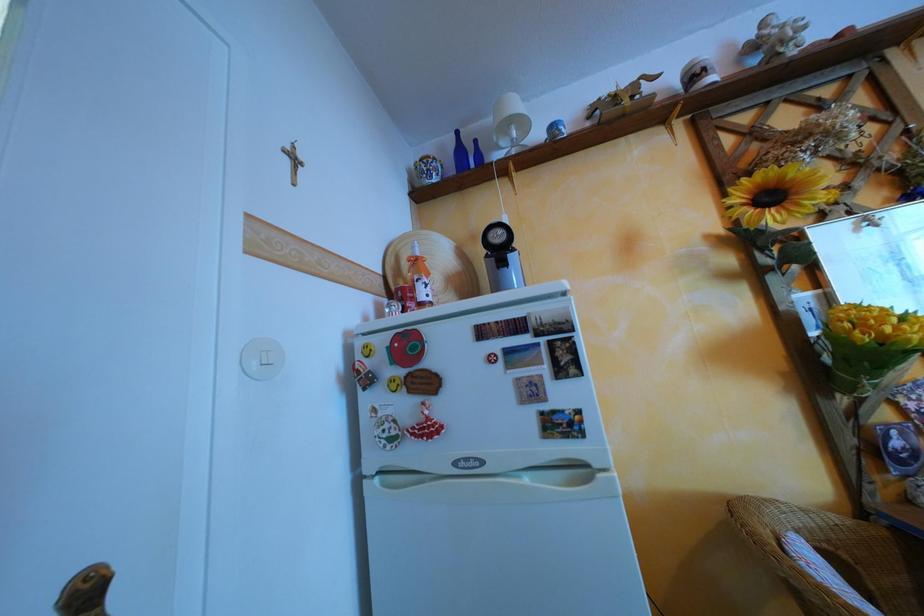
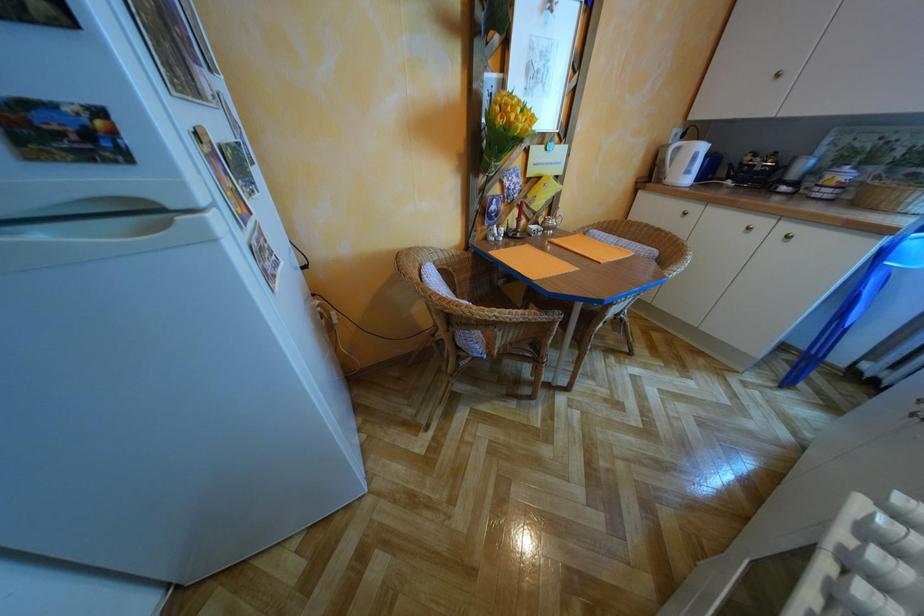
The first image is from the beginning of the video and the second image is from the end. How did the camera likely rotate when shooting the video?

The camera rotated toward right-down.